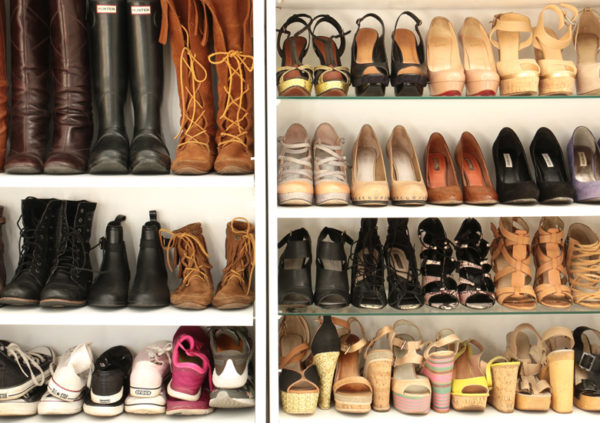
Image resolution: width=600 pixels, height=423 pixels. I want to click on white wooden shelf, so click(125, 420), click(126, 320), click(126, 183), click(409, 213), click(394, 415).